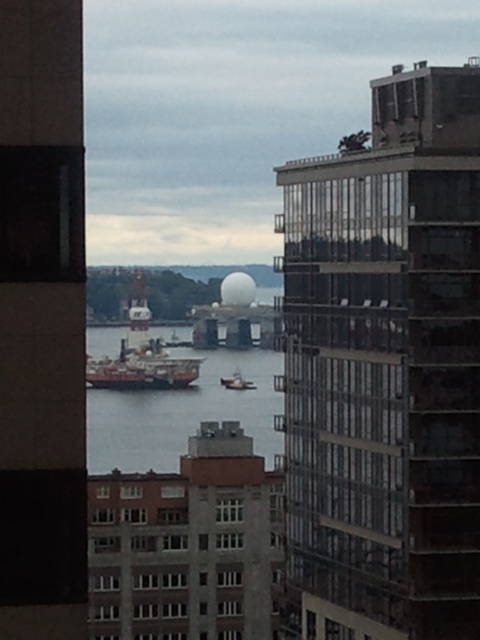
Question: Is smooth concrete tower at left further to camera compared to clear water at center?

Choices:
 (A) no
 (B) yes

Answer: (B)

Question: Among these points, which one is nearest to the camera?

Choices:
 (A) (115, 380)
 (B) (222, 400)
 (C) (145, 380)
 (D) (13, 269)

Answer: (D)

Question: Which point is closer to the camera taking this photo?

Choices:
 (A) (407, 200)
 (B) (128, 388)
 (C) (240, 374)
 (D) (147, 429)

Answer: (A)

Question: Does rustic wooden ship at center-left appear under shiny metallic ship at center?

Choices:
 (A) yes
 (B) no

Answer: (B)

Question: Where is smooth concrete tower at left located in relation to shiny metallic ship at center in the image?

Choices:
 (A) left
 (B) right

Answer: (B)

Question: Which point is farther to the camera?

Choices:
 (A) (137, 452)
 (B) (137, 284)
 (C) (8, 545)
 (D) (470, 545)

Answer: (B)